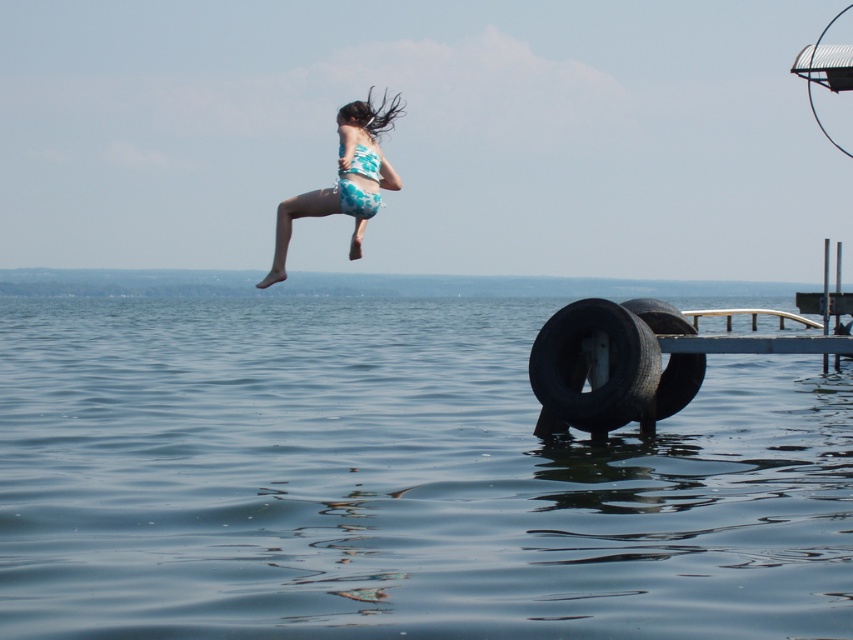
Image resolution: width=853 pixels, height=640 pixels. I want to click on transparent blue water at lower center, so click(x=396, y=481).

Who is more distant from viewer, (370, 346) or (689, 360)?

Positioned behind is point (370, 346).

What are the coordinates of `transparent blue water at lower center` in the screenshot? It's located at (396, 481).

How much distance is there between dark gray rubber tire at lower center and black rubber tire at lower right?

dark gray rubber tire at lower center is 3.55 feet from black rubber tire at lower right.

Is dark gray rubber tire at lower center bigger than black rubber tire at lower right?

Yes.

Identify the location of dark gray rubber tire at lower center. (592, 368).

Is point (602, 312) more distant than point (357, 248)?

Yes, it is behind point (357, 248).

Based on the photo, which is below, dark gray rubber tire at lower center or teal printed bikini at upper center?

Positioned lower is dark gray rubber tire at lower center.

Which is behind, point (625, 346) or point (373, 182)?

The point (625, 346) is more distant.

The image size is (853, 640). I want to click on dark gray rubber tire at lower center, so (x=592, y=368).